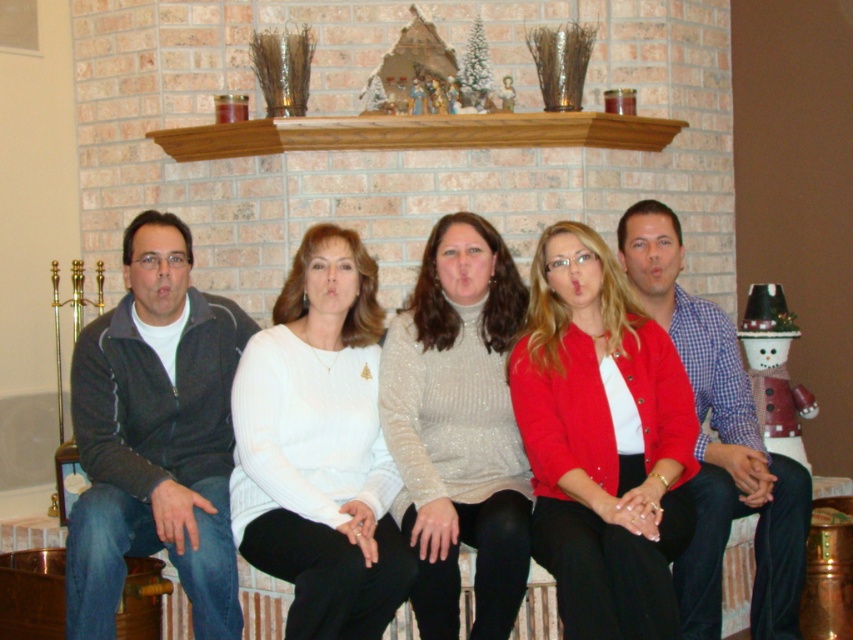
Question: Which object is positioned farthest from the matte black jacket at left?

Choices:
 (A) white sweater at center
 (B) sparkly white turtleneck sweater at center
 (C) matte red cardigan at center

Answer: (A)

Question: Is sparkly white turtleneck sweater at center bigger than matte black jacket at left?

Choices:
 (A) yes
 (B) no

Answer: (B)

Question: Which point is closer to the camera taking this photo?

Choices:
 (A) (350, 538)
 (B) (445, 320)

Answer: (A)

Question: Can you confirm if matte red cardigan at center is positioned to the right of sparkly white turtleneck sweater at center?

Choices:
 (A) yes
 (B) no

Answer: (A)

Question: Does matte red cardigan at center appear over matte black jacket at left?

Choices:
 (A) yes
 (B) no

Answer: (B)

Question: Which is farther from the matte black jacket at left?

Choices:
 (A) matte red cardigan at center
 (B) white sweater at center
 (C) sparkly white turtleneck sweater at center

Answer: (B)